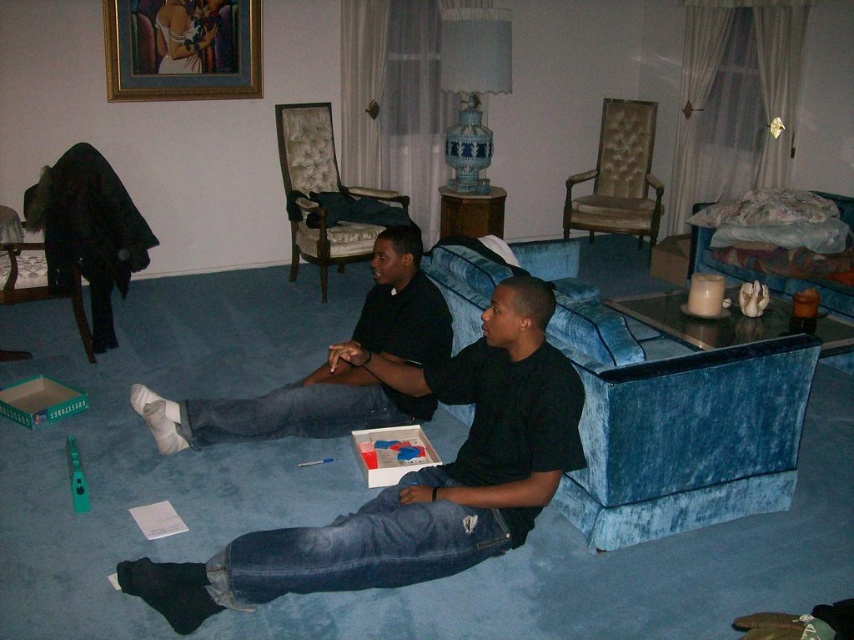
Identify the location of gold-framed artwork at upper left. (182, 49).

Can you confirm if gold-framed artwork at upper left is thinner than beige tufted fabric armchair at upper center?

No.

Does point (155, 67) come behind point (612, 104)?

No, (155, 67) is in front of (612, 104).

This screenshot has width=854, height=640. I want to click on gold-framed artwork at upper left, so click(182, 49).

Who is taller, velvet blue couch at lower center or velvet blue couch at right?

Standing taller between the two is velvet blue couch at lower center.

Can you confirm if velvet blue couch at lower center is positioned to the right of velvet blue couch at right?

No, velvet blue couch at lower center is not to the right of velvet blue couch at right.

The height and width of the screenshot is (640, 854). What do you see at coordinates (676, 424) in the screenshot? I see `velvet blue couch at lower center` at bounding box center [676, 424].

Identify the location of velvet blue couch at lower center. This screenshot has width=854, height=640. (676, 424).

Between point (369, 230) and point (45, 278), which one is positioned behind?

Positioned behind is point (369, 230).

Who is shorter, velvet upholstered armchair at center or velvet armchair at left?

velvet armchair at left is shorter.

Does point (367, 248) come behind point (19, 241)?

Yes, it is behind point (19, 241).

Identify the location of velvet upholstered armchair at center. (320, 192).